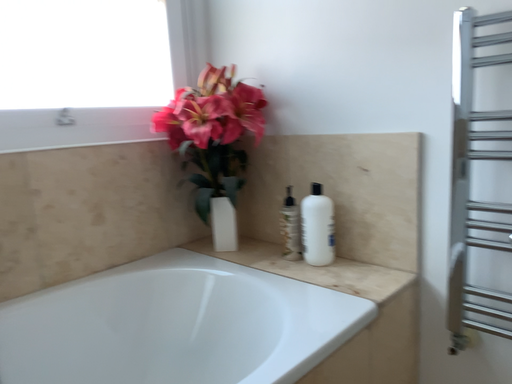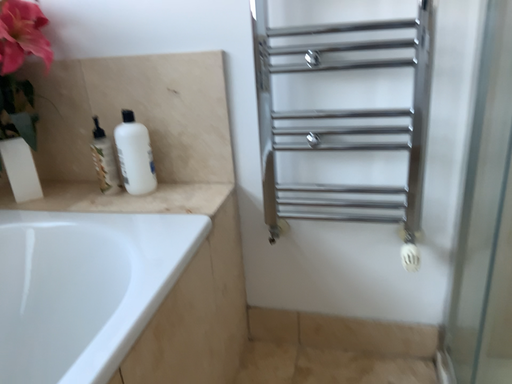
Question: Which way did the camera rotate in the video?

Choices:
 (A) rotated right
 (B) rotated left

Answer: (A)